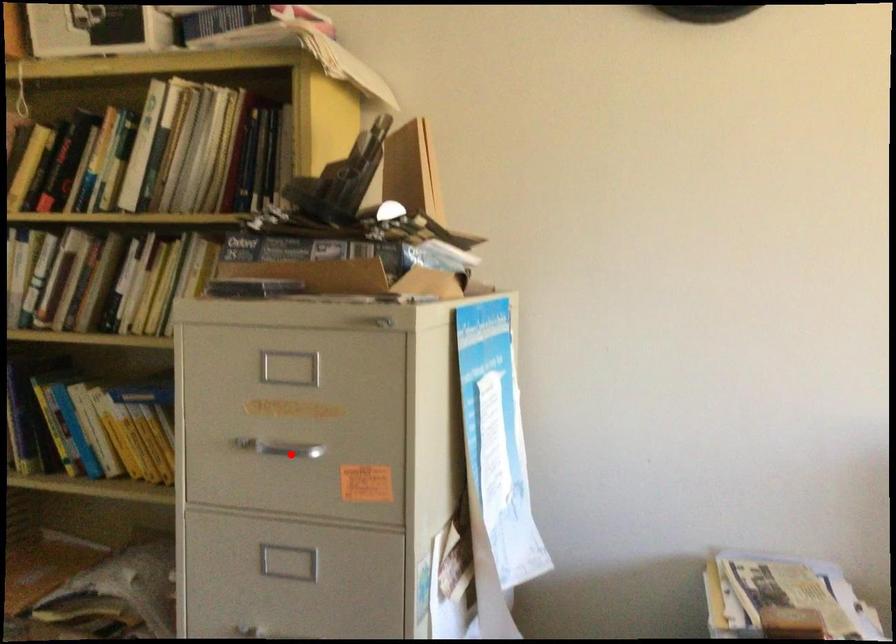
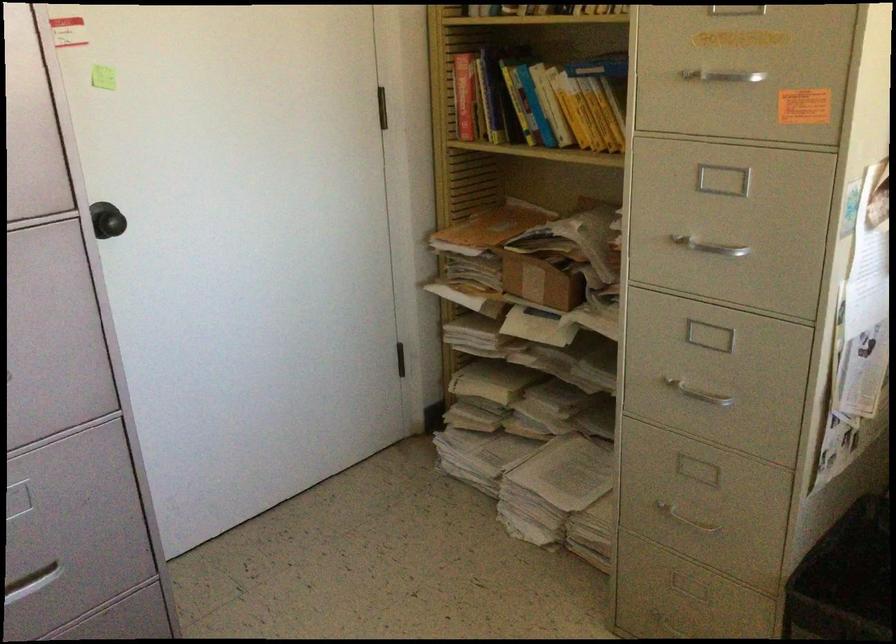
The point at the highlighted location is marked in the first image. Where is the corresponding point in the second image?

(725, 82)